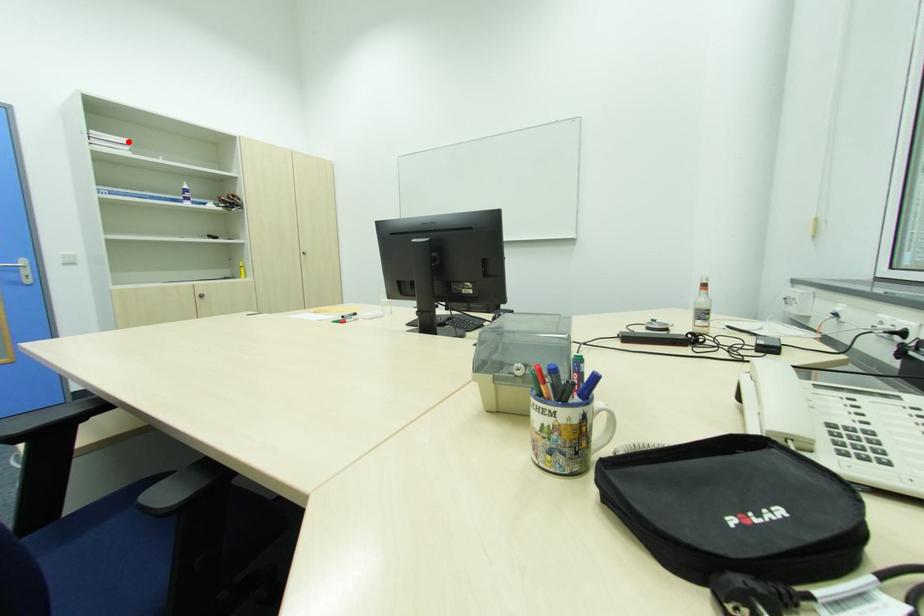
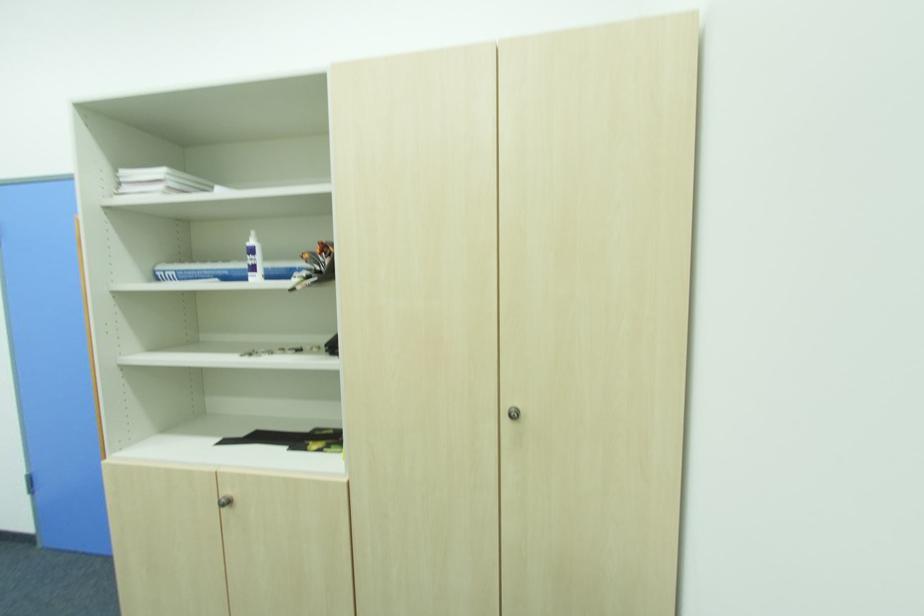
In the second image, find the point that corresponds to the highlighted location in the first image.

(161, 172)